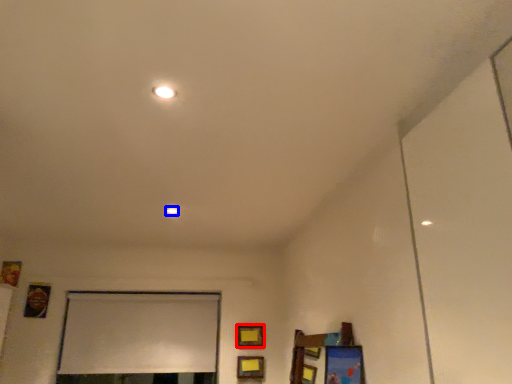
Question: Which of the following is the farthest to the observer, picture frame (highlighted by a red box) or light (highlighted by a blue box)?

Choices:
 (A) picture frame
 (B) light

Answer: (A)